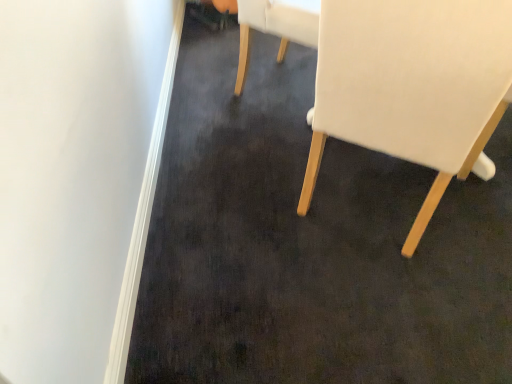
Question: In terms of width, does white fabric chair at upper center, arranged as the first chair when viewed from the back, look wider or thinner when compared to white fabric chair at right, placed as the 2th chair when sorted from back to front?

Choices:
 (A) thin
 (B) wide

Answer: (A)

Question: Looking at the image, does white fabric chair at upper center, which ranks as the second chair in front-to-back order, seem bigger or smaller compared to white fabric chair at right, placed as the 2th chair when sorted from back to front?

Choices:
 (A) small
 (B) big

Answer: (A)

Question: Is white fabric chair at upper center, arranged as the first chair when viewed from the back, in front of or behind white fabric chair at right, which is counted as the first chair, starting from the front, in the image?

Choices:
 (A) behind
 (B) front

Answer: (A)

Question: Considering the positions of white fabric chair at right, placed as the 2th chair when sorted from back to front, and white fabric chair at upper center, which ranks as the second chair in front-to-back order, in the image, is white fabric chair at right, placed as the 2th chair when sorted from back to front, taller or shorter than white fabric chair at upper center, which ranks as the second chair in front-to-back order,?

Choices:
 (A) tall
 (B) short

Answer: (A)

Question: In terms of size, does white fabric chair at right, which is counted as the first chair, starting from the front, appear bigger or smaller than white fabric chair at upper center, which ranks as the second chair in front-to-back order?

Choices:
 (A) small
 (B) big

Answer: (B)

Question: Is point (369, 84) closer or farther from the camera than point (240, 81)?

Choices:
 (A) closer
 (B) farther

Answer: (A)

Question: From a real-world perspective, is white fabric chair at right, placed as the 2th chair when sorted from back to front, above or below white fabric chair at upper center, which ranks as the second chair in front-to-back order?

Choices:
 (A) above
 (B) below

Answer: (A)